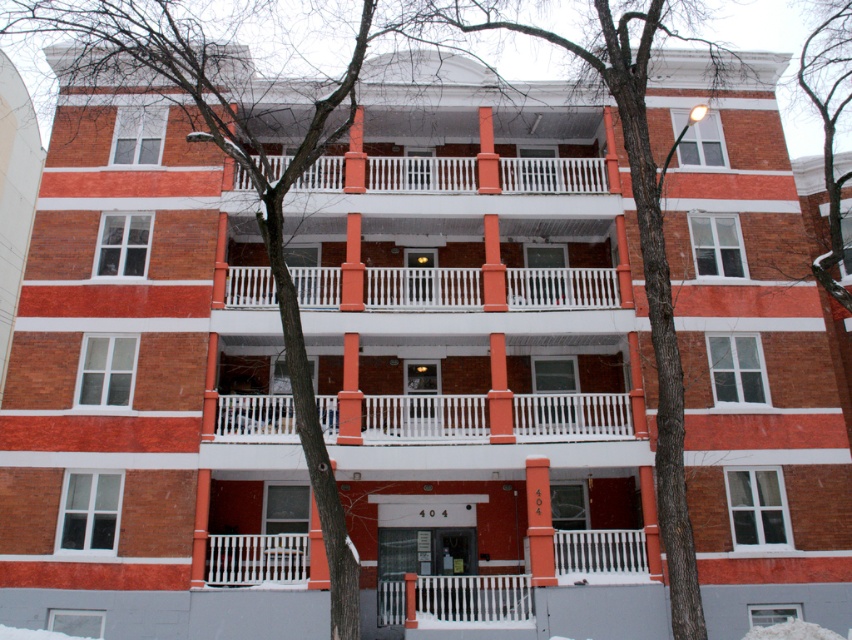
You are standing in front of the apartment building and notice a smooth bark tree at center and bare branches at upper center. Which object is closer to you?

The smooth bark tree at center is closer to you because it is in front of the bare branches at upper center.

You are standing in front of the apartment building and notice both the white painted wood balcony at center and the bare branches at upper center. Which object is positioned to the left when viewed from your perspective?

The white painted wood balcony at center is to the left of the bare branches at upper center.

You are an architect analyzing the winter scene. You notice the smooth bark tree at center and the bare branches at upper center. Which of these two has a larger diameter when comparing their trunks or branches?

The smooth bark tree at center is thinner than the bare branches at upper center, so the bare branches at upper center have a larger diameter.